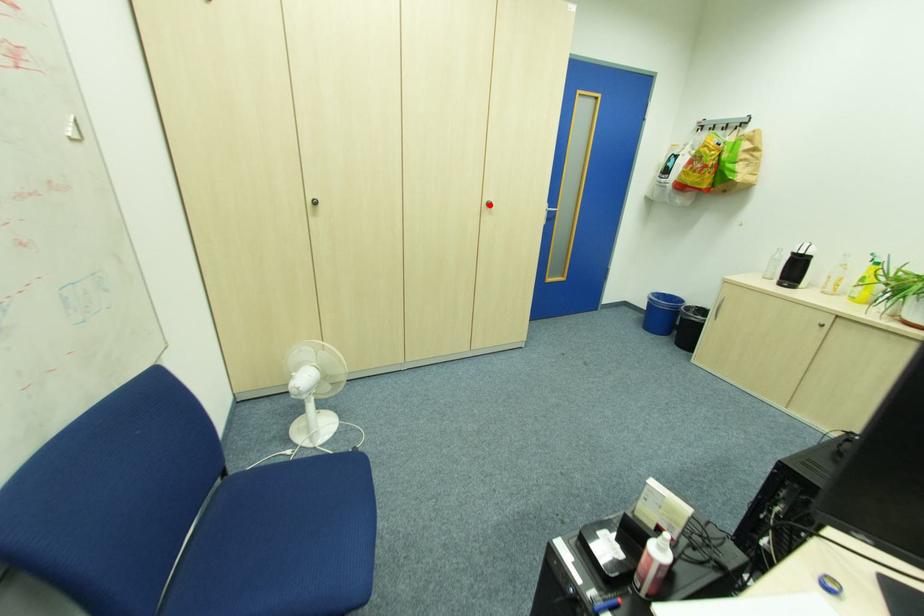
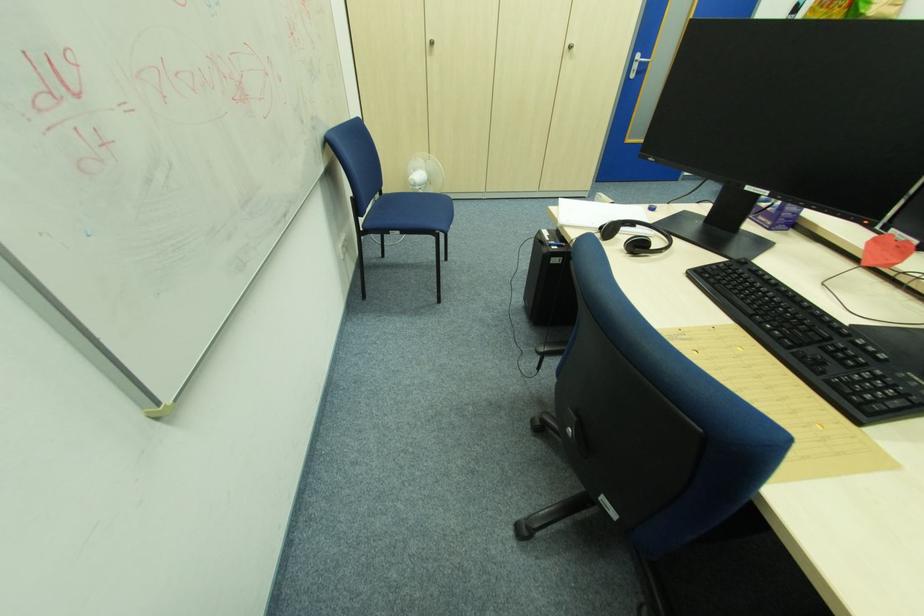
Where in the second image is the point corresponding to the highlighted location from the first image?

(572, 47)